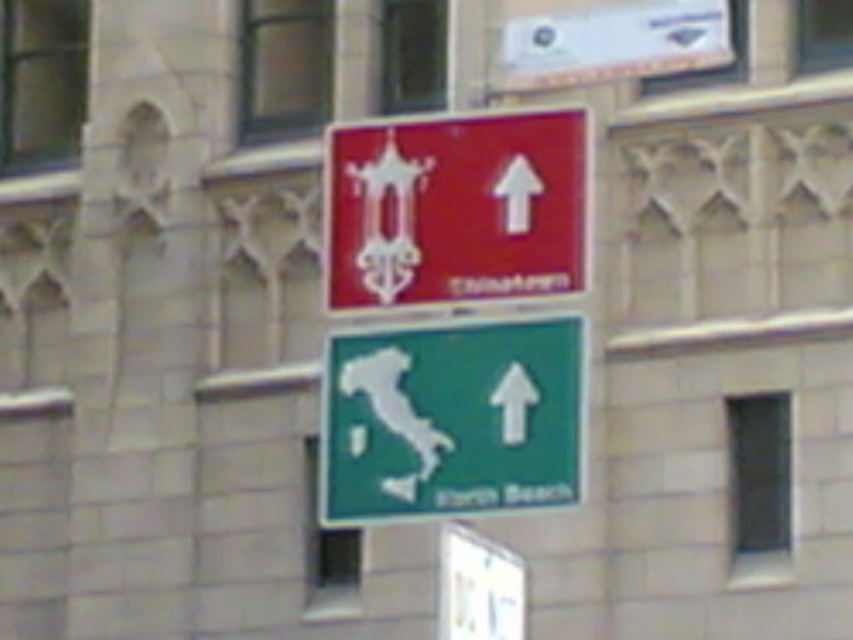
Does point (438, 376) come farther from viewer compared to point (585, 166)?

Yes, it is behind point (585, 166).

Does green matte map at center lie in front of matte red sign at center?

Yes, green matte map at center is closer to the viewer.

Who is more distant from viewer, (372, 378) or (337, 234)?

The point (337, 234) is behind.

I want to click on green matte map at center, so click(451, 419).